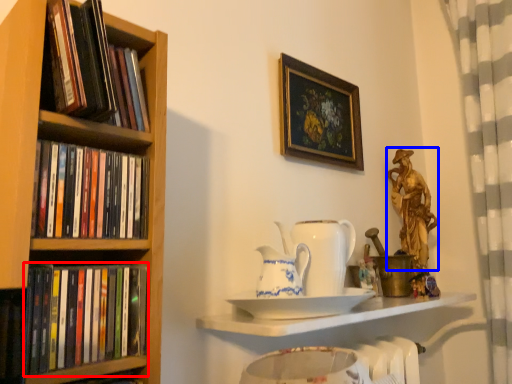
Question: Which point is further to the camera, book (highlighted by a red box) or deity (highlighted by a blue box)?

Choices:
 (A) book
 (B) deity

Answer: (B)